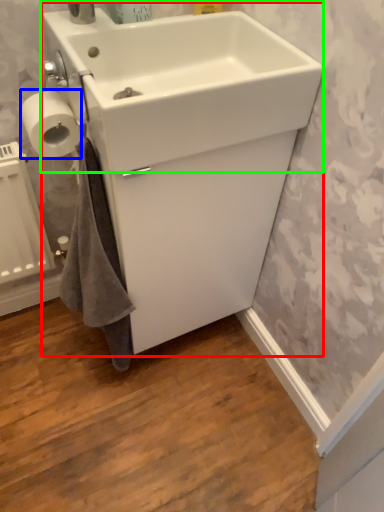
Question: Which object is positioned farthest from sink (highlighted by a red box)? Select from toilet paper (highlighted by a blue box) and sink (highlighted by a green box).

Choices:
 (A) toilet paper
 (B) sink

Answer: (A)